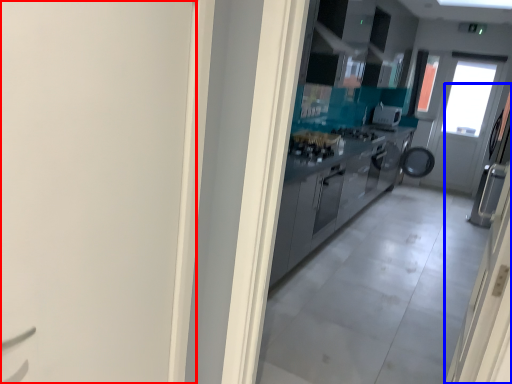
Question: Which object appears closest to the camera in this image, door (highlighted by a red box) or door (highlighted by a blue box)?

Choices:
 (A) door
 (B) door

Answer: (A)